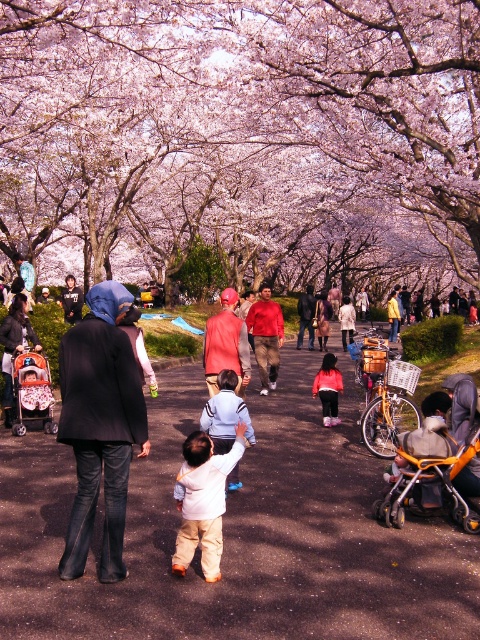
You are a photographer standing on the pathway in the park. You want to take a photo that includes both the denim jacket at left and the orange fleece jacket at center. Which jacket should you position closer to the left side of your camera frame to ensure both are in the shot?

Since the denim jacket at left is to the left of the orange fleece jacket at center, you should position the denim jacket at left closer to the left side of your camera frame to include both in the shot.

You are standing at the park entrance and see a pink blossom tree at center and light beige pants at center. Which object is closer to your right side?

The light beige pants at center is closer to your right side because the pink blossom tree at center is to the left of it.